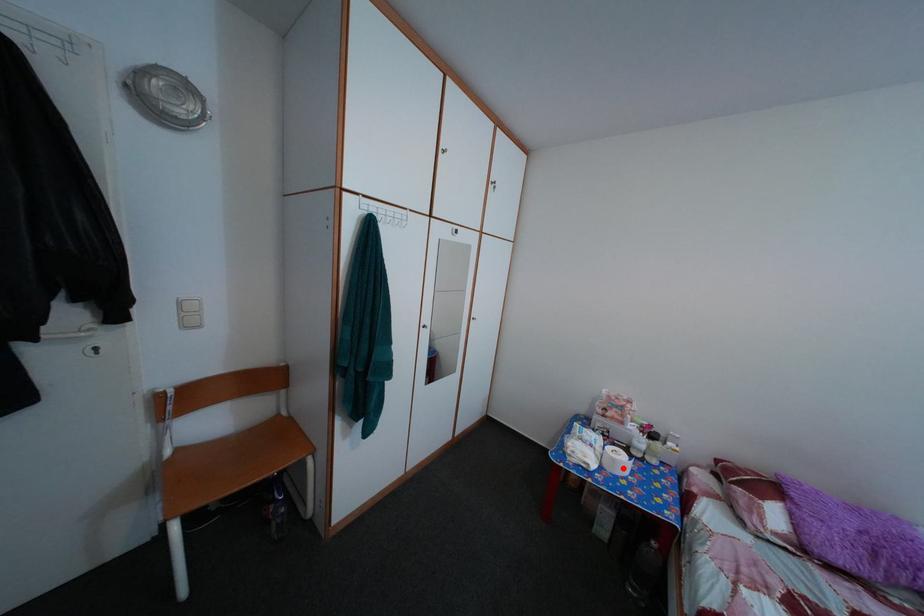
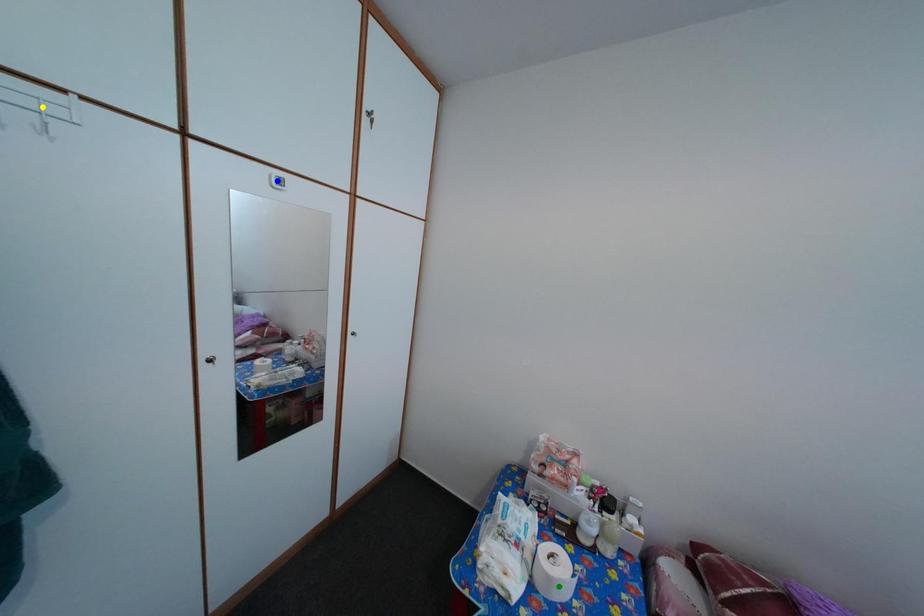
Question: I am providing you with two images of the same scene from different viewpoints. A red point is marked on the first image. You are given multiple points on the second image. Which point in image 2 represents the same 3d spot as the red point in image 1?

Choices:
 (A) yellow point
 (B) blue point
 (C) green point

Answer: (C)